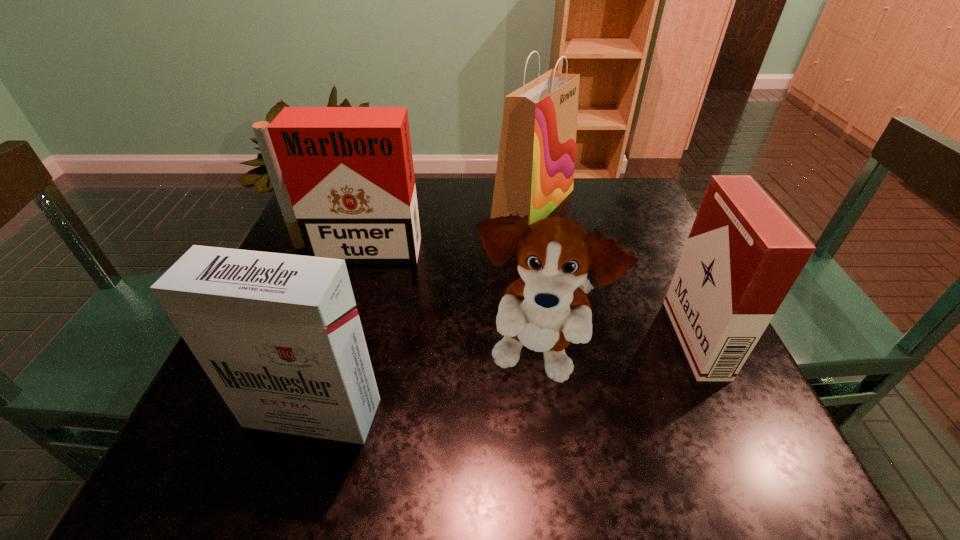
Find the location of `vacant space at the right edge of the desktop`. vacant space at the right edge of the desktop is located at coordinates (644, 368).

At what (x,y) coordinates should I click in order to perform the action: click on free region at the near left corner of the desktop. Please return your answer as a coordinate pair (x, y). The height and width of the screenshot is (540, 960). Looking at the image, I should click on (246, 450).

You are a GUI agent. You are given a task and a screenshot of the screen. Output one action in this format:
    pyautogui.click(x=<x>, y=<y>)
    Task: Click on the vacant area at the far right corner of the desktop
    
    Given the screenshot: What is the action you would take?
    pyautogui.click(x=599, y=187)

The height and width of the screenshot is (540, 960). Identify the location of free point between the nearest cigarette_case and the puppy. (424, 386).

Where is `free space that is in between the rightmost object and the nearest cigarette_case`? Image resolution: width=960 pixels, height=540 pixels. free space that is in between the rightmost object and the nearest cigarette_case is located at coordinates (504, 376).

I want to click on vacant area that lies between the puppy and the nearest cigarette_case, so coord(424,386).

You are a GUI agent. You are given a task and a screenshot of the screen. Output one action in this format:
    pyautogui.click(x=<x>, y=<y>)
    Task: Click on the vacant area that lies between the tallest object and the nearest cigarette_case
    
    Given the screenshot: What is the action you would take?
    pyautogui.click(x=423, y=309)

Select which object appears as the closest to the shopping bag. Please provide its 2D coordinates. Your answer should be formatted as a tuple, i.e. [(x, y)], where the tuple contains the x and y coordinates of a point satisfying the conditions above.

[(344, 179)]

You are a GUI agent. You are given a task and a screenshot of the screen. Output one action in this format:
    pyautogui.click(x=<x>, y=<y>)
    Task: Click on the object that is the second nearest to the farthest object
    The height and width of the screenshot is (540, 960).
    Given the screenshot: What is the action you would take?
    pyautogui.click(x=743, y=254)

Locate an element on the screen. The width and height of the screenshot is (960, 540). cigarette_case that is the second closest one to the fourth nearest object is located at coordinates (743, 254).